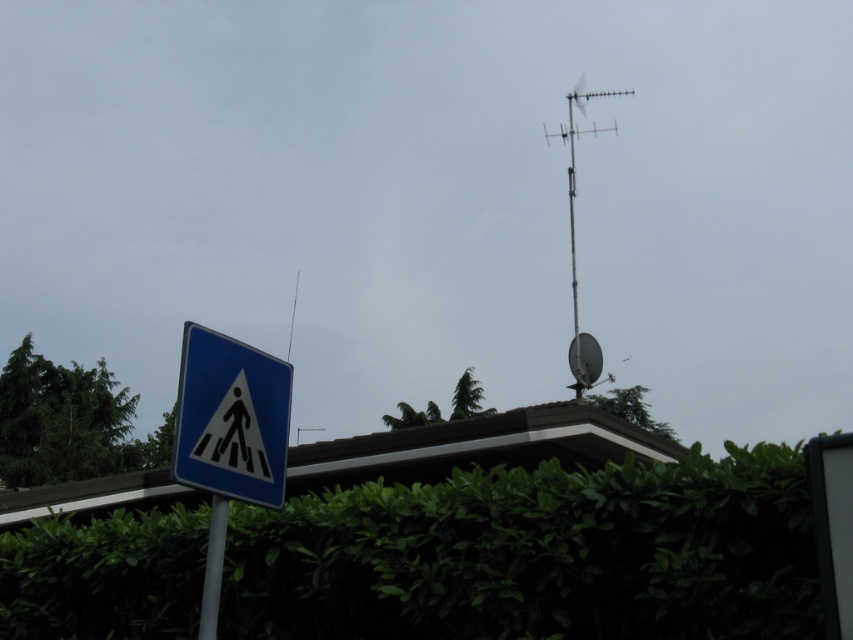
Between point (199, 364) and point (544, 125), which one is positioned in front?

Point (199, 364) is in front.

Is blue plastic pedestrian crossing sign at left to the left of metallic antenna at upper right from the viewer's perspective?

Indeed, blue plastic pedestrian crossing sign at left is positioned on the left side of metallic antenna at upper right.

Which is behind, point (183, 404) or point (578, 129)?

Positioned behind is point (578, 129).

The image size is (853, 640). I want to click on blue plastic pedestrian crossing sign at left, so click(x=231, y=419).

From the picture: Which is more to the left, green leafy hedge at lower center or white plastic pole at lower left?

white plastic pole at lower left

From the picture: Is green leafy hedge at lower center to the left of white plastic pole at lower left from the viewer's perspective?

Incorrect, green leafy hedge at lower center is not on the left side of white plastic pole at lower left.

Find the location of a particular element. Image resolution: width=853 pixels, height=640 pixels. green leafy hedge at lower center is located at coordinates (537, 556).

Image resolution: width=853 pixels, height=640 pixels. I want to click on green leafy hedge at lower center, so click(x=537, y=556).

Which is below, metallic antenna at upper right or white plastic pole at lower left?

Positioned lower is white plastic pole at lower left.

Does point (584, 342) lie in front of point (218, 588)?

No, it is not.

Is point (572, 170) behind point (212, 602)?

Yes.

Find the location of `metallic antenna at upper right`. metallic antenna at upper right is located at coordinates (573, 234).